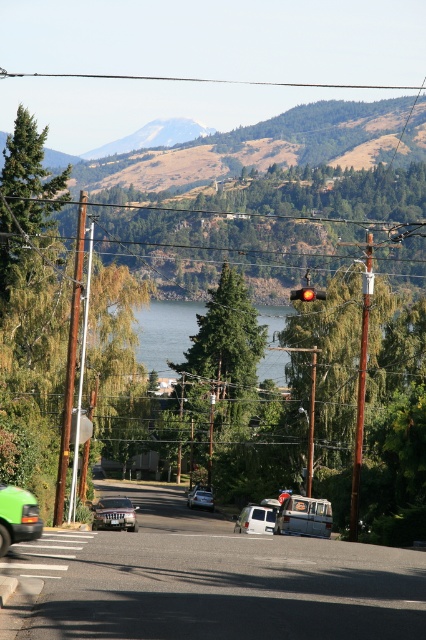
Does silver metallic suv at center have a lesser width compared to metallic silver sedan at center?

In fact, silver metallic suv at center might be wider than metallic silver sedan at center.

Does point (112, 497) lie in front of point (206, 502)?

Yes.

Locate an element on the screen. The height and width of the screenshot is (640, 426). silver metallic suv at center is located at coordinates (115, 513).

Between white matte van at center and metallic silver sedan at center, which one is positioned lower?

metallic silver sedan at center is below.

Does point (238, 520) lie behind point (204, 502)?

No, it is in front of (204, 502).

Where is `white matte van at center`? white matte van at center is located at coordinates (256, 518).

Describe the element at coordinates (152, 136) in the screenshot. Image resolution: width=426 pixels, height=640 pixels. I see `brown rocky mountain at upper center` at that location.

Between brown rocky mountain at upper center and green matte van at lower left, which one is positioned lower?

Positioned lower is green matte van at lower left.

The height and width of the screenshot is (640, 426). Identify the location of brown rocky mountain at upper center. (x=152, y=136).